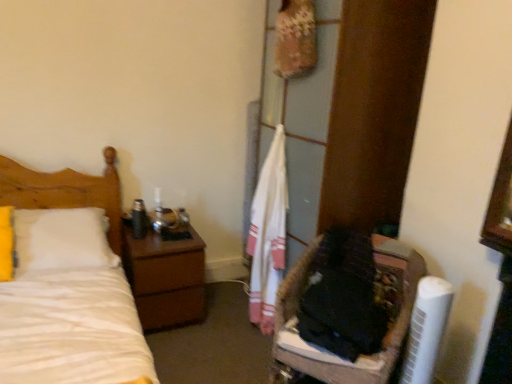
Locate an element on the screen. free location to the left of white cotton towel at center is located at coordinates (223, 322).